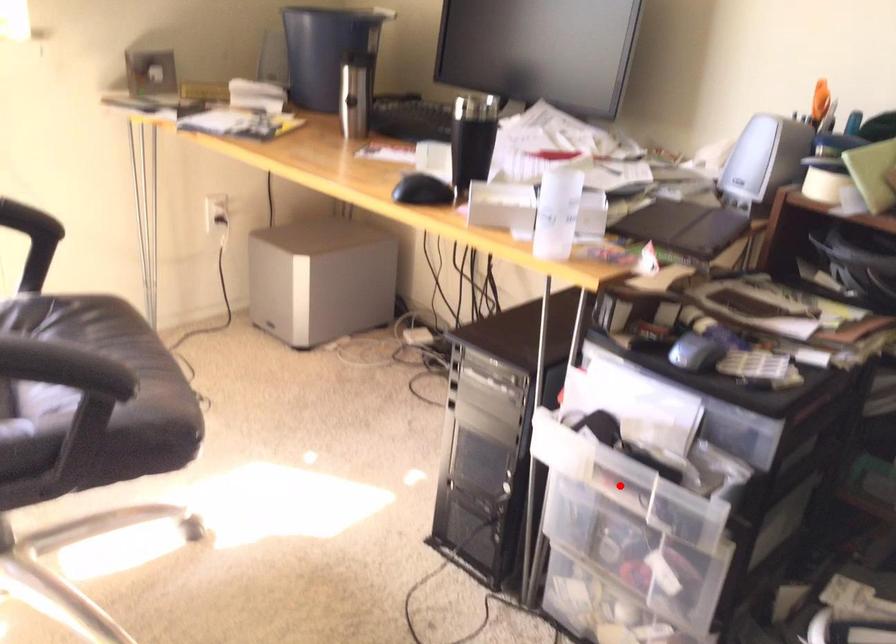
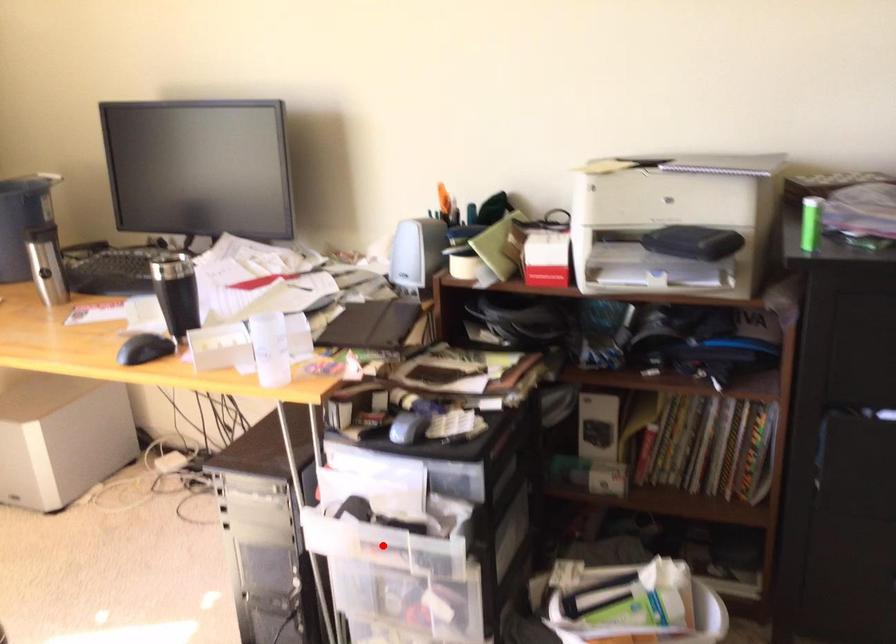
I am providing you with two images of the same scene from different viewpoints. A red point is marked on the first image and another point is marked on the second image. Does the point marked in image1 correspond to the same location as the one in image2?

Yes